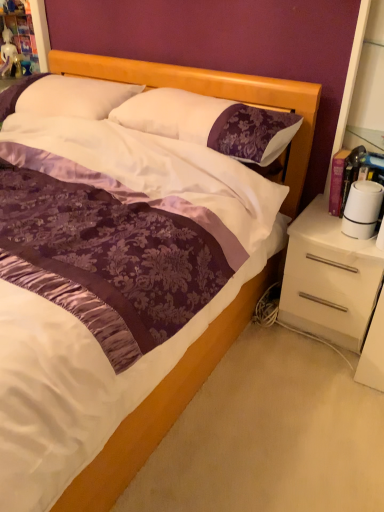
The width and height of the screenshot is (384, 512). What do you see at coordinates (330, 278) in the screenshot? I see `white glossy dresser at right` at bounding box center [330, 278].

What do you see at coordinates (64, 96) in the screenshot?
I see `white satin pillow at upper center, placed as the first pillow when sorted from left to right` at bounding box center [64, 96].

The height and width of the screenshot is (512, 384). Identify the location of white glossy drawer at right. (329, 292).

Is white satin pillow at upper center, acting as the second pillow starting from the right, situated inside white glossy drawer at right or outside?

white satin pillow at upper center, acting as the second pillow starting from the right, lies outside white glossy drawer at right.

Can you tell me how much white satin pillow at upper center, placed as the first pillow when sorted from left to right, and white glossy drawer at right differ in facing direction?

The angular difference between white satin pillow at upper center, placed as the first pillow when sorted from left to right, and white glossy drawer at right is 1.4 degrees.

Where is `the 2nd pillow counting from the left of the white glossy drawer at right`? This screenshot has height=512, width=384. the 2nd pillow counting from the left of the white glossy drawer at right is located at coordinates (64, 96).

From the image's perspective, which one is positioned lower, white satin pillow at upper center, acting as the second pillow starting from the right, or purple satin pillow at center, the 1th pillow when ordered from right to left?

purple satin pillow at center, the 1th pillow when ordered from right to left, appears lower in the image.

Can you confirm if white satin pillow at upper center, placed as the first pillow when sorted from left to right, is positioned to the right of purple satin pillow at center, the 1th pillow when ordered from right to left?

In fact, white satin pillow at upper center, placed as the first pillow when sorted from left to right, is to the left of purple satin pillow at center, the 1th pillow when ordered from right to left.

Does white satin pillow at upper center, acting as the second pillow starting from the right, lie in front of purple satin pillow at center, positioned as the 2th pillow in left-to-right order?

No.

Between point (89, 94) and point (242, 124), which one is positioned behind?

The point (89, 94) is behind.

Considering the relative positions of purple satin pillow at center, the 1th pillow when ordered from right to left, and white glossy drawer at right in the image provided, is purple satin pillow at center, the 1th pillow when ordered from right to left, to the right of white glossy drawer at right from the viewer's perspective?

No, purple satin pillow at center, the 1th pillow when ordered from right to left, is not to the right of white glossy drawer at right.

Between purple satin pillow at center, the 1th pillow when ordered from right to left, and white glossy drawer at right, which one has more height?

white glossy drawer at right.

Locate an element on the screen. drawer below the purple satin pillow at center, positioned as the 2th pillow in left-to-right order (from the image's perspective) is located at coordinates (329, 292).

Is purple satin pillow at center, positioned as the 2th pillow in left-to-right order, smaller than white glossy drawer at right?

Correct, purple satin pillow at center, positioned as the 2th pillow in left-to-right order, occupies less space than white glossy drawer at right.

Is purple satin pillow at center, positioned as the 2th pillow in left-to-right order, inside or outside of white glossy dresser at right?

purple satin pillow at center, positioned as the 2th pillow in left-to-right order, is not inside white glossy dresser at right, it's outside.

How different are the orientations of purple satin pillow at center, positioned as the 2th pillow in left-to-right order, and white glossy dresser at right in degrees?

They differ by 0.305 degrees in their facing directions.

Considering the sizes of purple satin pillow at center, the 1th pillow when ordered from right to left, and white glossy dresser at right in the image, is purple satin pillow at center, the 1th pillow when ordered from right to left, taller or shorter than white glossy dresser at right?

purple satin pillow at center, the 1th pillow when ordered from right to left, is shorter than white glossy dresser at right.

Is purple satin pillow at center, positioned as the 2th pillow in left-to-right order, turned away from white glossy dresser at right?

That's not correct — purple satin pillow at center, positioned as the 2th pillow in left-to-right order, is not looking away from white glossy dresser at right.

From the image's perspective, which one is positioned higher, white satin pillow at upper center, placed as the first pillow when sorted from left to right, or white glossy dresser at right?

white satin pillow at upper center, placed as the first pillow when sorted from left to right, appears higher in the image.

Visually, is white satin pillow at upper center, acting as the second pillow starting from the right, positioned to the left or to the right of white glossy dresser at right?

From the image, it's evident that white satin pillow at upper center, acting as the second pillow starting from the right, is to the left of white glossy dresser at right.

Looking at this image, which of these two, white satin pillow at upper center, placed as the first pillow when sorted from left to right, or white glossy dresser at right, stands taller?

With more height is white glossy dresser at right.

The width and height of the screenshot is (384, 512). I want to click on pillow located underneath the purple satin pillow at center, positioned as the 2th pillow in left-to-right order (from a real-world perspective), so click(64, 96).

Looking at this image, from a real-world perspective, which object stands above the other?

In real-world perspective, purple satin pillow at center, the 1th pillow when ordered from right to left, is above.

Does point (145, 115) come closer to viewer compared to point (0, 110)?

Yes, it is.

Between white glossy drawer at right and white glossy dresser at right, which one has less height?

white glossy drawer at right.

Considering the relative sizes of white glossy drawer at right and white glossy dresser at right in the image provided, is white glossy drawer at right smaller than white glossy dresser at right?

Correct, white glossy drawer at right occupies less space than white glossy dresser at right.

This screenshot has width=384, height=512. Find the location of `drawer behind the white glossy dresser at right`. drawer behind the white glossy dresser at right is located at coordinates (329, 292).

Is white glossy drawer at right wider than white glossy dresser at right?

Correct, the width of white glossy drawer at right exceeds that of white glossy dresser at right.

At what (x,y) coordinates should I click in order to perform the action: click on drawer below the white satin pillow at upper center, acting as the second pillow starting from the right (from a real-world perspective). Please return your answer as a coordinate pair (x, y). Image resolution: width=384 pixels, height=512 pixels. Looking at the image, I should click on (329, 292).

Identify the location of pillow on the right of white satin pillow at upper center, placed as the first pillow when sorted from left to right. This screenshot has width=384, height=512. (211, 123).

In the scene shown: Based on their spatial positions, is white glossy dresser at right or white glossy drawer at right further from purple satin pillow at center, positioned as the 2th pillow in left-to-right order?

white glossy drawer at right is positioned further to the anchor purple satin pillow at center, positioned as the 2th pillow in left-to-right order.

Based on the photo, estimate the real-world distances between objects in this image. Which object is further from white glossy drawer at right, purple satin pillow at center, the 1th pillow when ordered from right to left, or white satin pillow at upper center, placed as the first pillow when sorted from left to right?

The object further to white glossy drawer at right is white satin pillow at upper center, placed as the first pillow when sorted from left to right.

Based on their spatial positions, is white glossy dresser at right or white satin pillow at upper center, placed as the first pillow when sorted from left to right, further from purple satin pillow at center, positioned as the 2th pillow in left-to-right order?

The object further to purple satin pillow at center, positioned as the 2th pillow in left-to-right order, is white glossy dresser at right.

Considering their positions, is white satin pillow at upper center, acting as the second pillow starting from the right, positioned further to white glossy drawer at right than white glossy dresser at right?

white satin pillow at upper center, acting as the second pillow starting from the right, is positioned further to the anchor white glossy drawer at right.

From the image, which object appears to be nearer to white glossy drawer at right, purple satin pillow at center, positioned as the 2th pillow in left-to-right order, or white glossy dresser at right?

white glossy dresser at right lies closer to white glossy drawer at right than the other object.

Based on their spatial positions, is white glossy dresser at right or purple satin pillow at center, positioned as the 2th pillow in left-to-right order, further from white glossy drawer at right?

purple satin pillow at center, positioned as the 2th pillow in left-to-right order.

Considering their positions, is white glossy drawer at right positioned further to white satin pillow at upper center, acting as the second pillow starting from the right, than purple satin pillow at center, positioned as the 2th pillow in left-to-right order?

white glossy drawer at right lies further to white satin pillow at upper center, acting as the second pillow starting from the right, than the other object.

In the scene shown: Looking at the image, which one is located closer to white satin pillow at upper center, acting as the second pillow starting from the right, white glossy drawer at right or white glossy dresser at right?

The object closer to white satin pillow at upper center, acting as the second pillow starting from the right, is white glossy drawer at right.

Where is `pillow between white satin pillow at upper center, placed as the first pillow when sorted from left to right, and white glossy dresser at right from left to right`? Image resolution: width=384 pixels, height=512 pixels. pillow between white satin pillow at upper center, placed as the first pillow when sorted from left to right, and white glossy dresser at right from left to right is located at coordinates (211, 123).

Where is `pillow between white satin pillow at upper center, acting as the second pillow starting from the right, and white glossy drawer at right`? The width and height of the screenshot is (384, 512). pillow between white satin pillow at upper center, acting as the second pillow starting from the right, and white glossy drawer at right is located at coordinates (211, 123).

I want to click on dresser located between white satin pillow at upper center, placed as the first pillow when sorted from left to right, and white glossy drawer at right in the left-right direction, so pyautogui.click(x=330, y=278).

Identify the location of dresser between purple satin pillow at center, the 1th pillow when ordered from right to left, and white glossy drawer at right from left to right. The width and height of the screenshot is (384, 512). (330, 278).